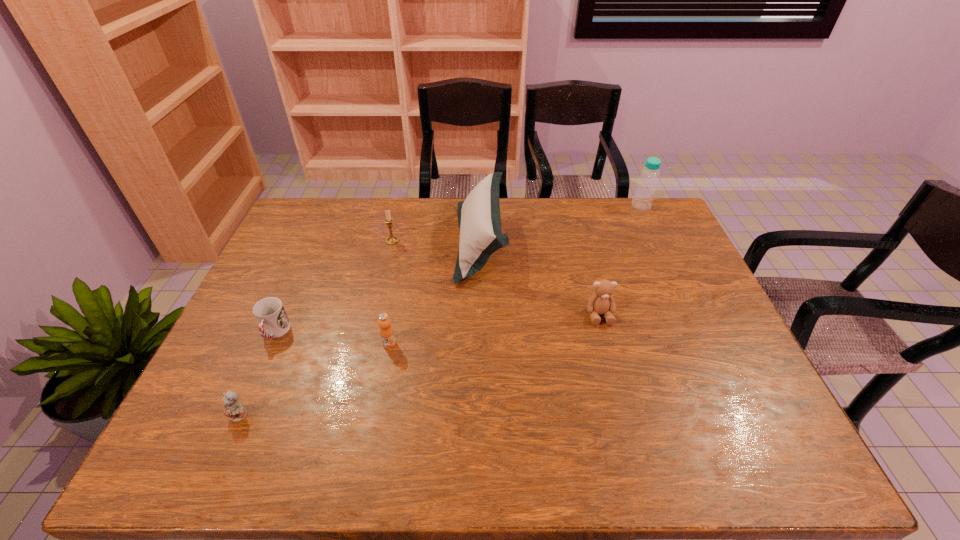
Locate an element on the screen. This screenshot has width=960, height=540. blank area located on the surface of the fifth object from left to right is located at coordinates (381, 242).

Find the location of a particular element. The height and width of the screenshot is (540, 960). free space located 0.350m on the surface of the fifth object from left to right is located at coordinates (350, 242).

Locate an element on the screen. Image resolution: width=960 pixels, height=540 pixels. free space located 0.180m on the surface of the fifth object from left to right is located at coordinates (401, 242).

This screenshot has width=960, height=540. I want to click on vacant point located on the front of the third object from left to right, so click(x=381, y=287).

At what (x,y) coordinates should I click in order to perform the action: click on free space located on the face of the taller teddy bear. Please return your answer as a coordinate pair (x, y). Looking at the image, I should click on (616, 380).

Identify the location of vacant space located 0.200m on the front label of the orange juice. (375, 420).

Identify the location of free spot located 0.120m on the side of the cup where the handle is located. (251, 387).

The width and height of the screenshot is (960, 540). I want to click on free space located on the front-facing side of the nearest object, so click(x=224, y=453).

This screenshot has height=540, width=960. In order to click on bottle at the far edge in this screenshot , I will do pos(642,200).

Locate an element on the screen. This screenshot has width=960, height=540. cushion at the far edge is located at coordinates (479, 219).